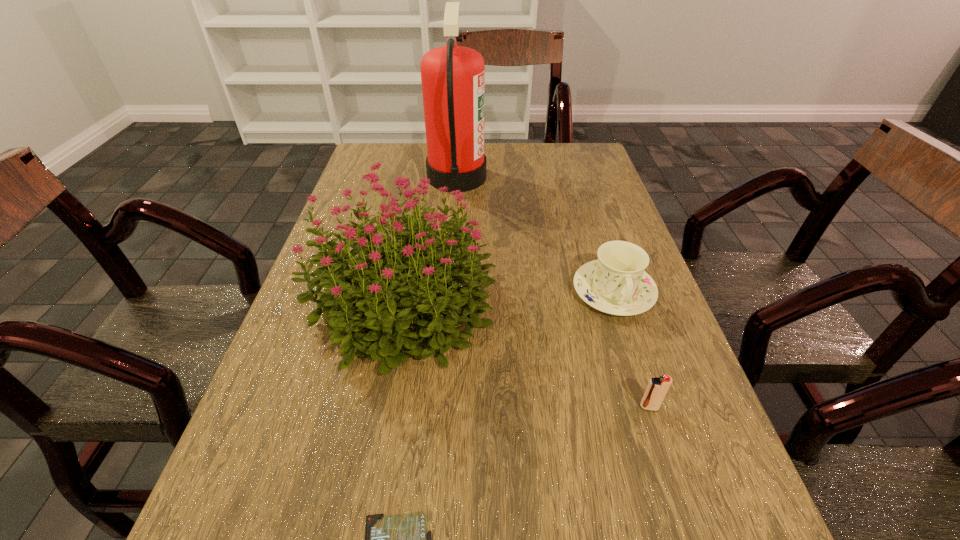
Locate an element on the screen. object located in the far edge section of the desktop is located at coordinates (453, 77).

Identify the location of object present at the left edge. (360, 306).

At what (x,y) coordinates should I click in order to perform the action: click on chinaware present at the right edge. Please return your answer as a coordinate pair (x, y). Image resolution: width=960 pixels, height=540 pixels. Looking at the image, I should click on click(616, 283).

Locate an element on the screen. This screenshot has height=540, width=960. igniter that is at the right edge is located at coordinates (657, 388).

The width and height of the screenshot is (960, 540). I want to click on free region at the far edge of the desktop, so click(426, 144).

The width and height of the screenshot is (960, 540). Identify the location of vacant area at the left edge of the desktop. (339, 399).

Find the location of a particular element. The width and height of the screenshot is (960, 540). vacant area at the right edge of the desktop is located at coordinates (613, 196).

This screenshot has width=960, height=540. Identify the location of vacant space at the far left corner of the desktop. (411, 159).

The image size is (960, 540). I want to click on free space at the far right corner, so click(x=570, y=170).

In order to click on vacant area between the farthest object and the third tallest object in this screenshot , I will do `click(536, 234)`.